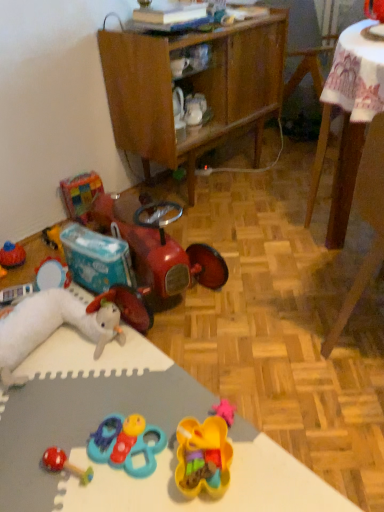
Find the location of a particular element. The image size is (384, 512). vacant space that is in between wooden chair at lower right and rubberized red car at lower left, placed as the fourth toy when sorted from right to left is located at coordinates tap(254, 301).